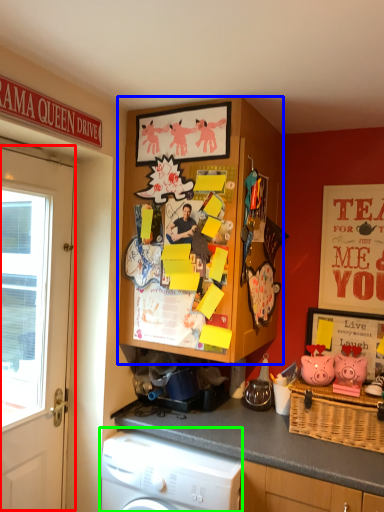
Question: Which object is the closest to the door (highlighted by a red box)? Choose among these: cabinetry (highlighted by a blue box) or washing machine (highlighted by a green box).

Choices:
 (A) cabinetry
 (B) washing machine

Answer: (B)